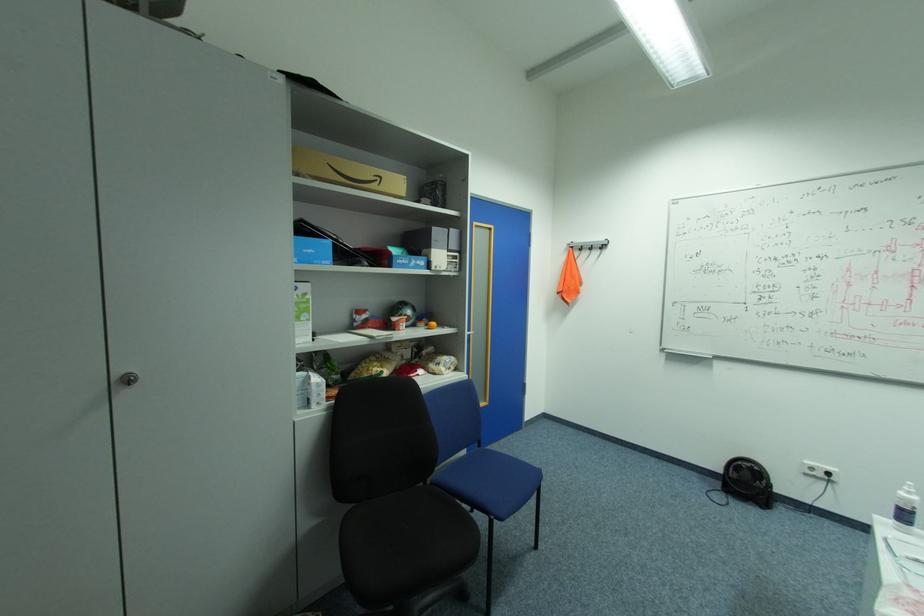
Where would you turn the cabinet door lock? Please return your answer as a coordinate pair (x, y).

(128, 379)